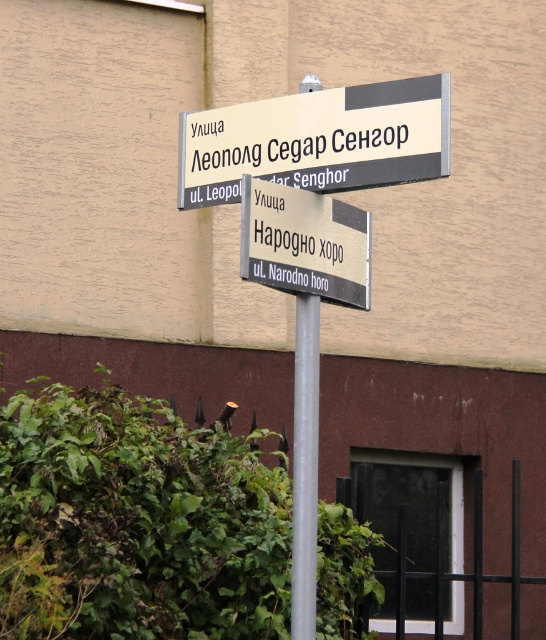
You are a delivery driver who needs to read the street names on the signpost. Which direction should you look to see the matte plastic street sign at upper center first?

The matte plastic street sign at upper center is located at point (317, 140), so you should look towards the upper center direction to see it first.

From the picture: You are a delivery driver who needs to read both street signs on the pole. The matte plastic street sign at upper center has text written in Cyrillic script. The metallic silver sign at center also has text in Cyrillic script. Which sign has a wider physical width?

The matte plastic street sign at upper center might be wider than metallic silver sign at center according to the description.